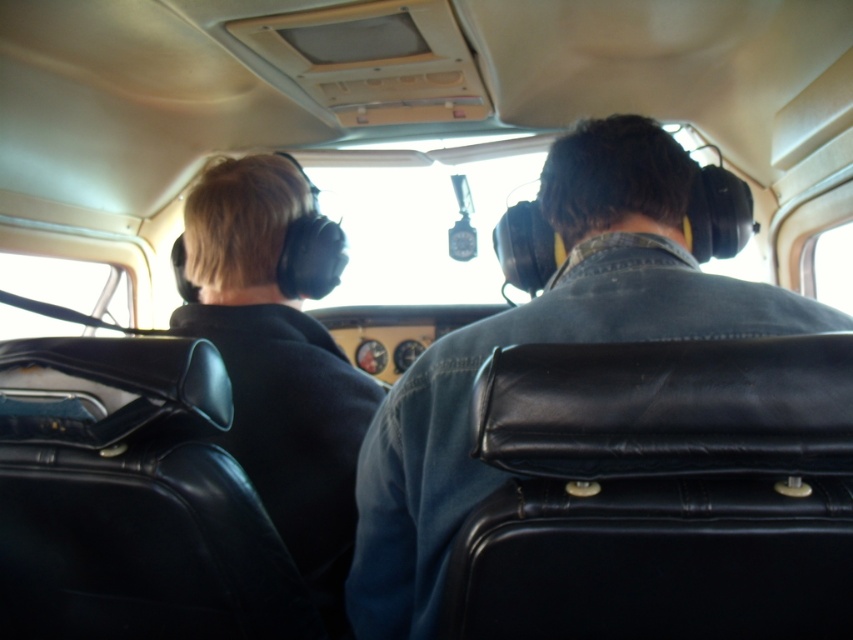
Question: Which object is farther from the camera taking this photo?

Choices:
 (A) black leather suitcase at center
 (B) denim jacket at center

Answer: (B)

Question: Which object appears farthest from the camera in this image?

Choices:
 (A) denim jacket at center
 (B) black leather suitcase at center

Answer: (A)

Question: Does black leather suitcase at center have a lesser width compared to denim jacket at center?

Choices:
 (A) no
 (B) yes

Answer: (B)

Question: Does black leather suitcase at center appear under denim jacket at center?

Choices:
 (A) yes
 (B) no

Answer: (A)

Question: Which point appears closest to the camera in this image?

Choices:
 (A) (611, 412)
 (B) (422, 397)

Answer: (A)

Question: Is black leather suitcase at center to the right of denim jacket at center from the viewer's perspective?

Choices:
 (A) no
 (B) yes

Answer: (A)